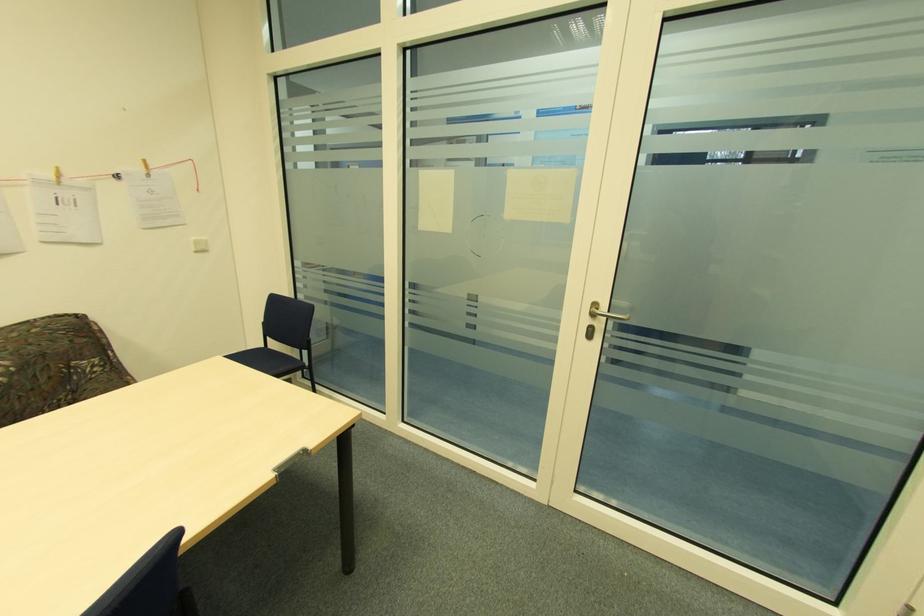
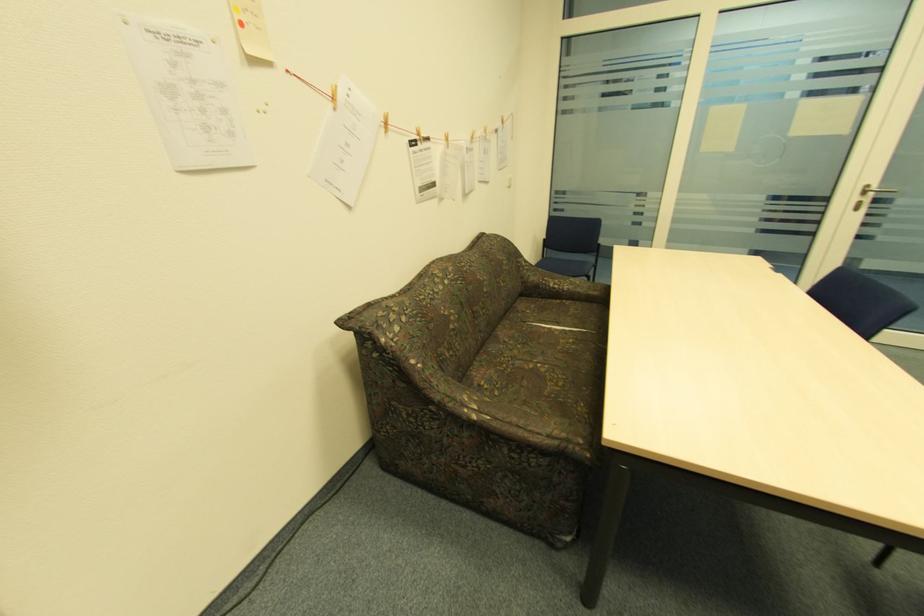
In the second image, find the point that corresponds to [598,304] in the first image.

(870, 187)